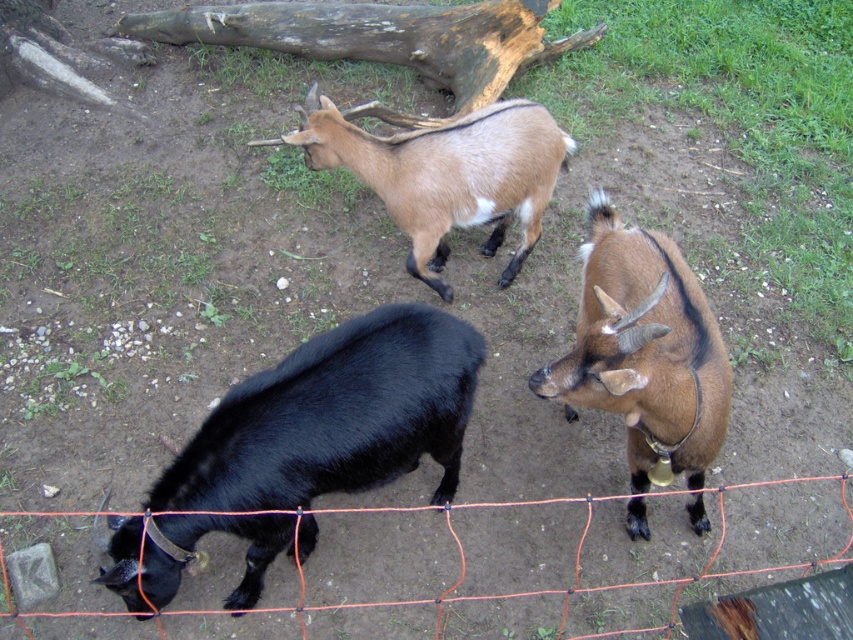
Does brown matte goat at center-right have a larger size compared to brown weathered log at upper center?

Incorrect, brown matte goat at center-right is not larger than brown weathered log at upper center.

Can you confirm if brown matte goat at center-right is wider than brown weathered log at upper center?

In fact, brown matte goat at center-right might be narrower than brown weathered log at upper center.

Does point (711, 449) come closer to viewer compared to point (548, 40)?

Yes, point (711, 449) is in front of point (548, 40).

Locate an element on the screen. brown matte goat at center-right is located at coordinates (643, 352).

Is point (376, 346) positioned before point (438, 84)?

Yes, point (376, 346) is closer to viewer.

The image size is (853, 640). In order to click on black glossy goat at lower left in this screenshot , I will do `click(335, 417)`.

Find the location of a particular element. This screenshot has width=853, height=640. black glossy goat at lower left is located at coordinates (335, 417).

Find the location of a particular element. The image size is (853, 640). black glossy goat at lower left is located at coordinates (335, 417).

Between brown matte goat at upper center and orange mesh fence at lower center, which one appears on the right side from the viewer's perspective?

orange mesh fence at lower center

This screenshot has height=640, width=853. What do you see at coordinates (445, 173) in the screenshot? I see `brown matte goat at upper center` at bounding box center [445, 173].

Image resolution: width=853 pixels, height=640 pixels. Describe the element at coordinates (445, 173) in the screenshot. I see `brown matte goat at upper center` at that location.

Identify the location of brown matte goat at upper center. This screenshot has width=853, height=640. (445, 173).